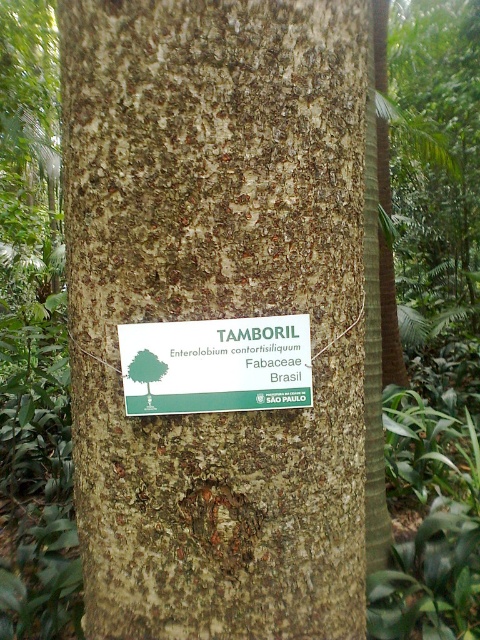
Based on the photo, you are a botanist examining the tree trunk. You need to determine if the green paper sign at center can be fully covered by the brown rough bark at center without overlapping its edges. Can this be done?

The brown rough bark at center is wider than the green paper sign at center, so yes, the green paper sign at center can be fully covered by the brown rough bark at center without overlapping its edges.

You are standing 1 meter away from a tree trunk with a white sign attached. The point on the sign labeled as point (x=275, y=371) is exactly where the text starts. Can you reach this point on the sign without moving closer than 1 meter?

The point (x=275, y=371) is 1.04 meters away from you, so you cannot reach it without moving closer than 1 meter.